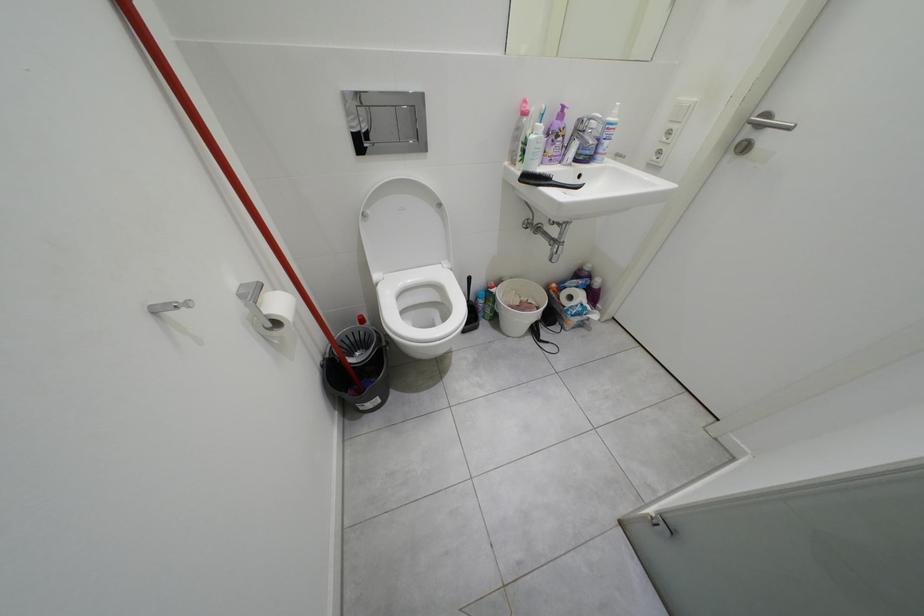
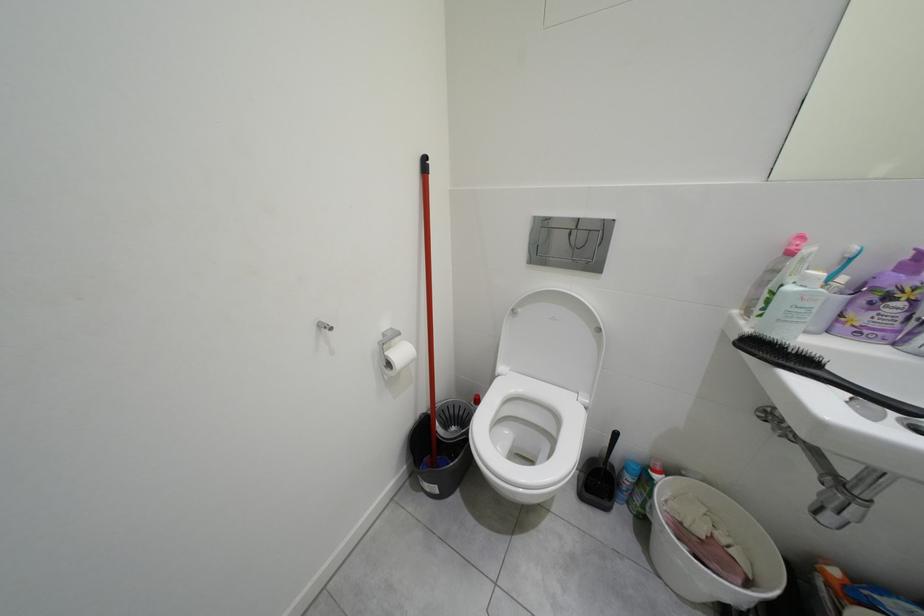
Question: The camera is either moving clockwise (left) or counter-clockwise (right) around the object. The first image is from the beginning of the video and the second image is from the end. Is the camera moving left or right when shooting the video?

Choices:
 (A) Left
 (B) Right

Answer: (B)